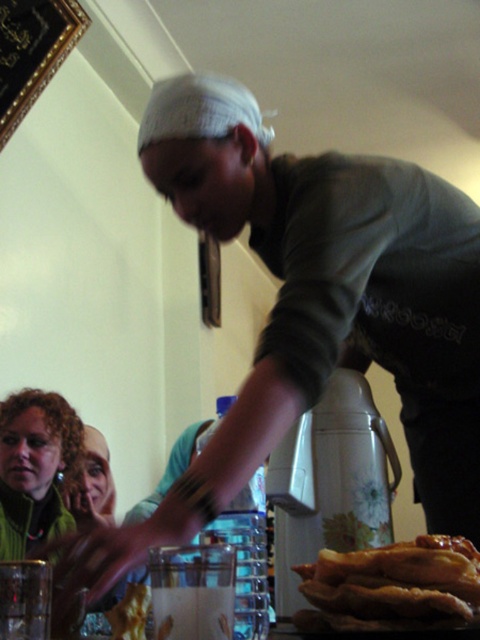
Question: Which object is closer to the camera taking this photo?

Choices:
 (A) golden crispy pastry at lower right
 (B) white plastic blender at center

Answer: (A)

Question: Is white plastic blender at center to the left of golden crispy pastry at lower right from the viewer's perspective?

Choices:
 (A) no
 (B) yes

Answer: (B)

Question: Which point is farther to the camera?

Choices:
 (A) (302, 496)
 (B) (393, 550)

Answer: (A)

Question: In this image, where is white plastic blender at center located relative to golden crispy pastry at lower right?

Choices:
 (A) above
 (B) below

Answer: (A)

Question: Is white plastic blender at center to the right of golden crispy pastry at lower right from the viewer's perspective?

Choices:
 (A) yes
 (B) no

Answer: (B)